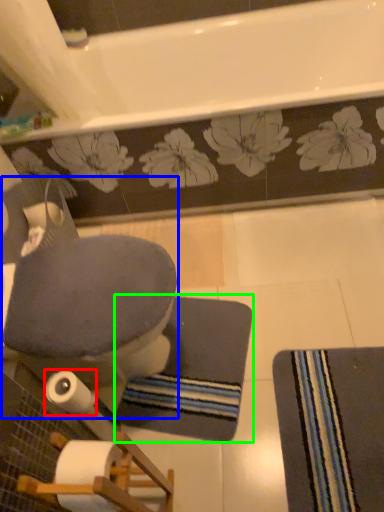
Question: Which object is the farthest from toilet paper (highlighted by a red box)? Choose among these: rocking chair (highlighted by a blue box) or bath mat (highlighted by a green box).

Choices:
 (A) rocking chair
 (B) bath mat

Answer: (B)